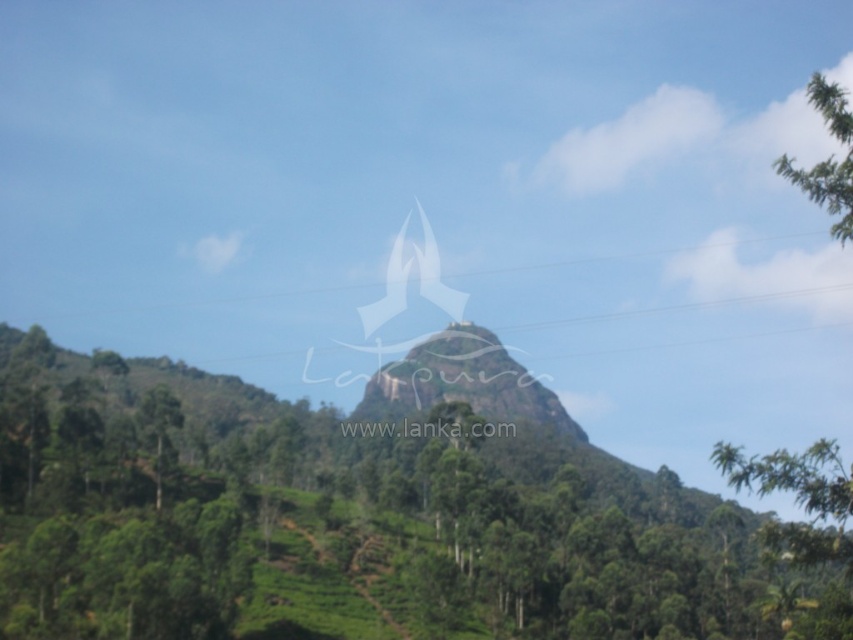
Question: Which object is closer to the camera taking this photo?

Choices:
 (A) green leafy tree at upper right
 (B) green leafy tree at center

Answer: (B)

Question: Does green leafy tree at center have a greater width compared to green leafy tree at upper right?

Choices:
 (A) yes
 (B) no

Answer: (A)

Question: Which point is farther to the camera?

Choices:
 (A) green leafy tree at upper right
 (B) green leafy tree at center

Answer: (A)

Question: Does green leafy tree at center appear on the right side of green leafy tree at upper right?

Choices:
 (A) yes
 (B) no

Answer: (B)

Question: Is green leafy tree at center wider than green leafy tree at upper right?

Choices:
 (A) yes
 (B) no

Answer: (A)